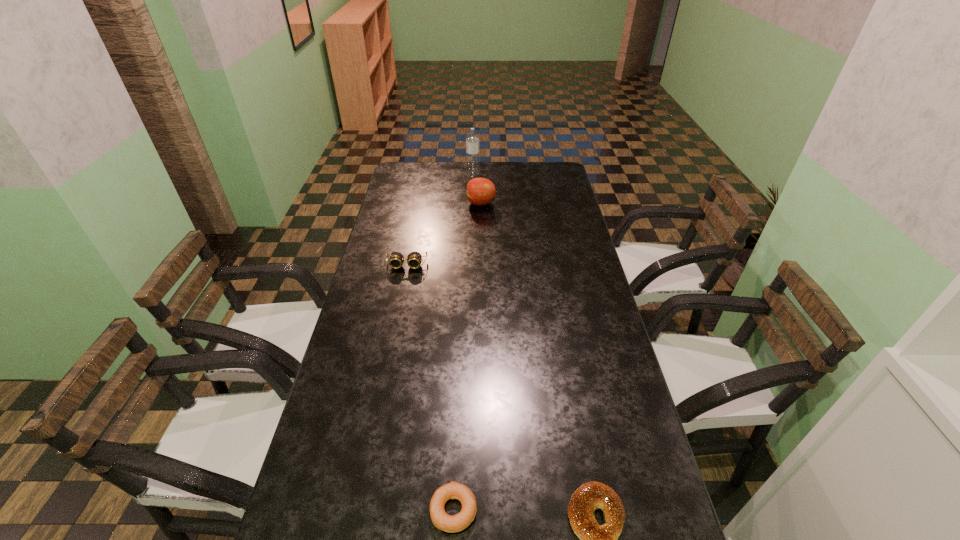
This screenshot has height=540, width=960. In order to click on water bottle in this screenshot , I will do `click(472, 138)`.

Where is `the tallest object`? the tallest object is located at coordinates (472, 138).

Locate an element on the screen. This screenshot has height=540, width=960. apple is located at coordinates (480, 191).

Find the location of `the second tallest object`. the second tallest object is located at coordinates (480, 191).

In order to click on the third nearest object in this screenshot , I will do `click(414, 259)`.

This screenshot has width=960, height=540. I want to click on the third shortest object, so click(x=414, y=259).

Where is `the left bagel`? The width and height of the screenshot is (960, 540). the left bagel is located at coordinates (453, 490).

Find the location of a particular element. The height and width of the screenshot is (540, 960). free location located on the front of the water bottle is located at coordinates (472, 203).

Identify the location of free region located on the front of the apple. This screenshot has height=540, width=960. (481, 237).

Find the location of `free location located through the lenses of the third farthest object`. free location located through the lenses of the third farthest object is located at coordinates (400, 297).